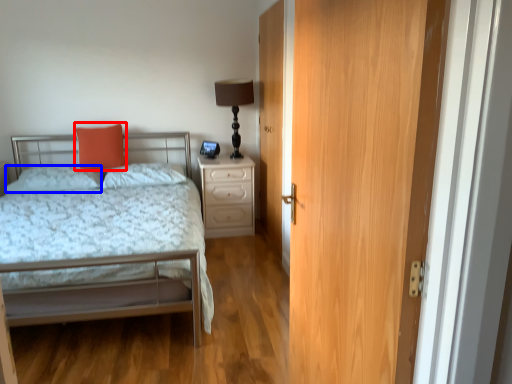
Question: Which object is further to the camera taking this photo, throw pillow (highlighted by a red box) or pillow (highlighted by a blue box)?

Choices:
 (A) throw pillow
 (B) pillow

Answer: (A)